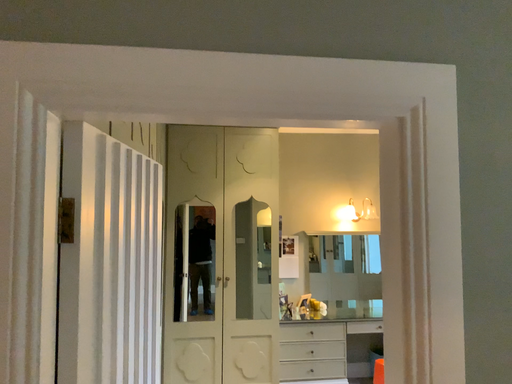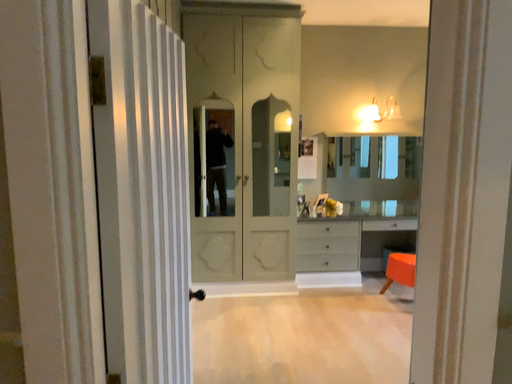
Question: Which way did the camera rotate in the video?

Choices:
 (A) rotated downward
 (B) rotated upward

Answer: (A)